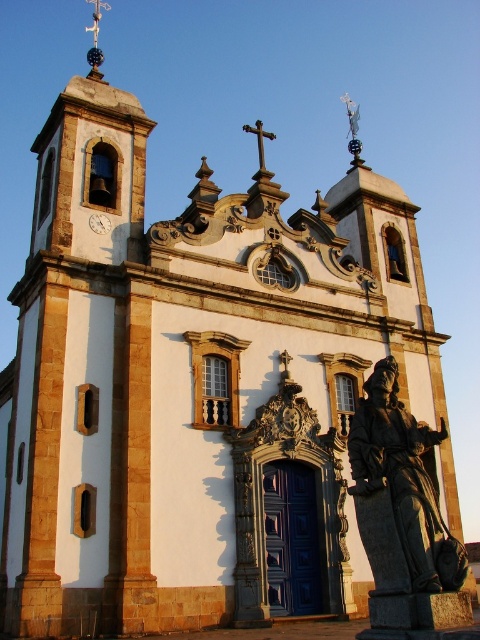
Question: Is bronze statue at center wider than metallic clock at center?

Choices:
 (A) no
 (B) yes

Answer: (B)

Question: Which of the following is the farthest from the observer?

Choices:
 (A) (91, 218)
 (B) (365, 476)

Answer: (A)

Question: Can you confirm if bronze statue at center is wider than metallic clock at center?

Choices:
 (A) no
 (B) yes

Answer: (B)

Question: Among these objects, which one is nearest to the camera?

Choices:
 (A) metallic clock at center
 (B) bronze statue at center

Answer: (B)

Question: Is bronze statue at center below metallic clock at center?

Choices:
 (A) yes
 (B) no

Answer: (A)

Question: Which point appears closest to the camera in this image?

Choices:
 (A) (376, 426)
 (B) (88, 220)

Answer: (A)